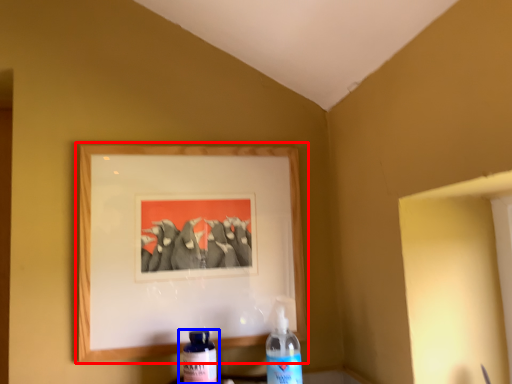
Question: Which object appears closest to the camera in this image, picture frame (highlighted by a red box) or bottle (highlighted by a blue box)?

Choices:
 (A) picture frame
 (B) bottle

Answer: (B)